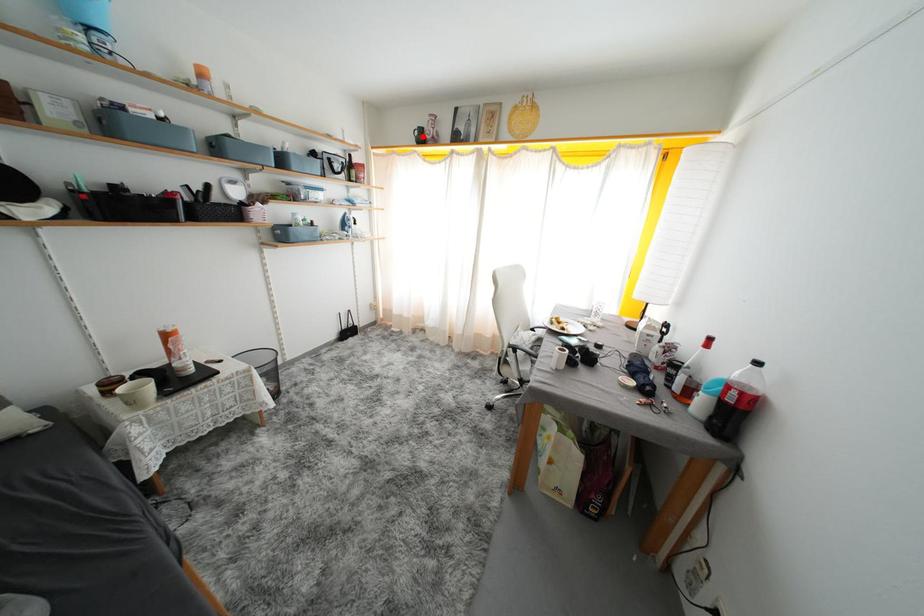
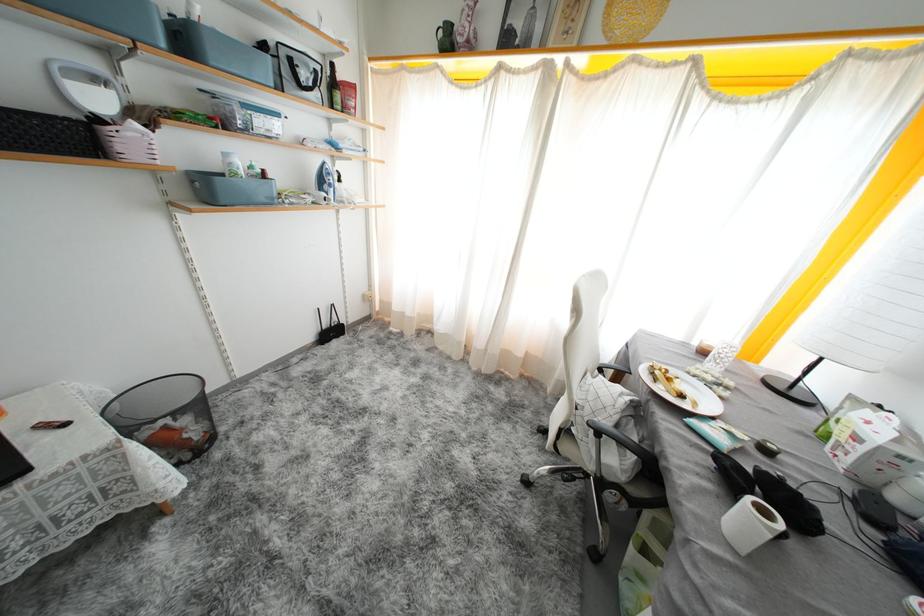
Question: I am providing you with two images of the same scene from different viewpoints. A red point is marked on the first image. Can you still see the location of the red point in image 2?

Choices:
 (A) Yes
 (B) No

Answer: (A)